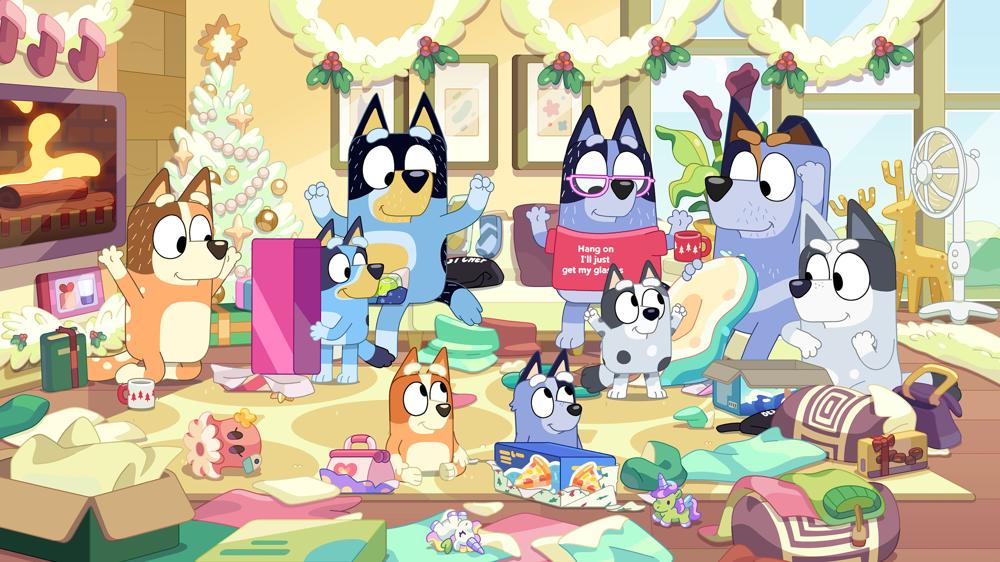
Find the location of a particular element. The height and width of the screenshot is (562, 1000). stocking is located at coordinates (21, 24), (49, 49), (89, 44).